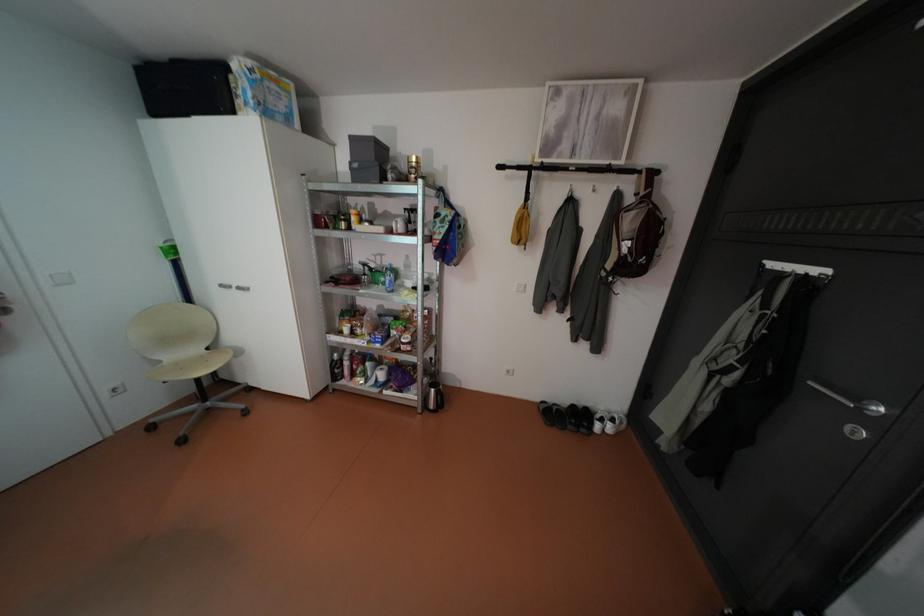
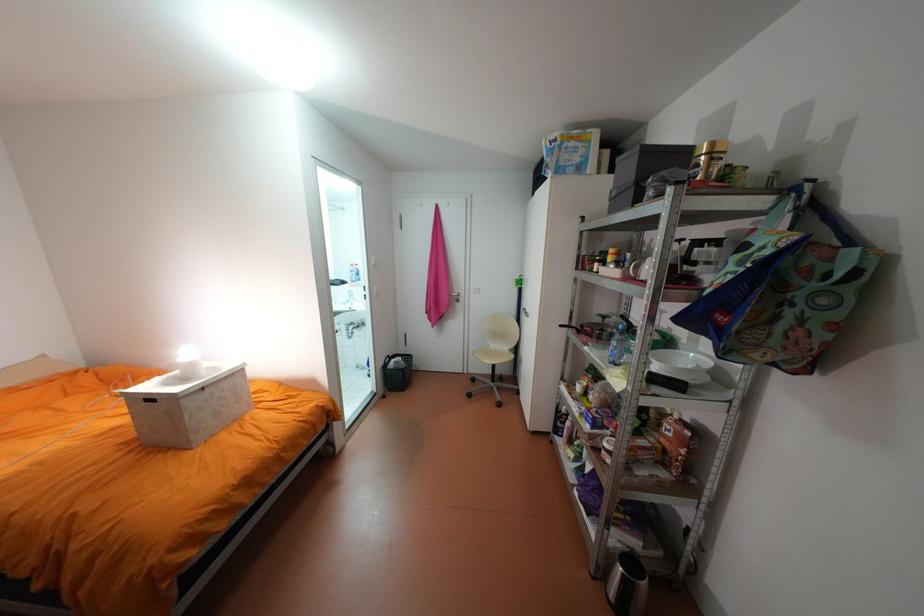
In the second image, find the point that corresponds to point (427, 156) in the first image.

(722, 143)